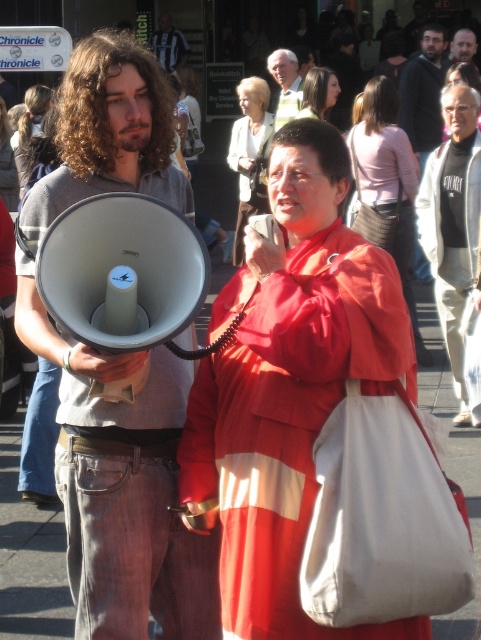
Question: Which of the following is the closest to the observer?

Choices:
 (A) (473, 36)
 (B) (278, 70)
 (C) (8, 147)
 (D) (303, 97)

Answer: (D)

Question: Is dark gray sweater at upper right smaller than smooth brown hair at upper center?

Choices:
 (A) no
 (B) yes

Answer: (A)

Question: Does gray knit sweater at center have a larger size compared to matte pink sweater at center?

Choices:
 (A) yes
 (B) no

Answer: (B)

Question: Which object is positioned farthest from the striped jersey at center?

Choices:
 (A) smooth brown hair at upper center
 (B) matte gray megaphone at left
 (C) matte red kimono at center

Answer: (C)

Question: Which of the following is the farthest from the observer?

Choices:
 (A) (x=292, y=83)
 (B) (x=419, y=40)

Answer: (B)

Question: Is matte gray megaphone at left closer to camera compared to gray knit sweater at center?

Choices:
 (A) no
 (B) yes

Answer: (B)